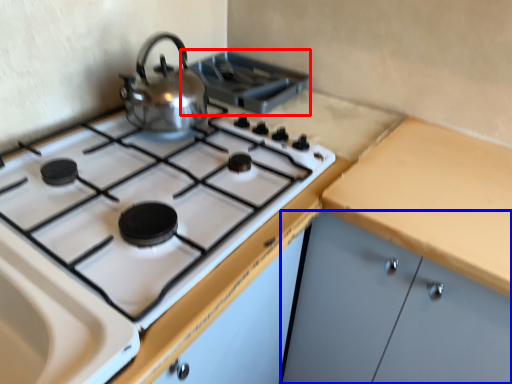
Question: Among these objects, which one is nearest to the camera, appliance (highlighted by a red box) or cabinetry (highlighted by a blue box)?

Choices:
 (A) appliance
 (B) cabinetry

Answer: (B)